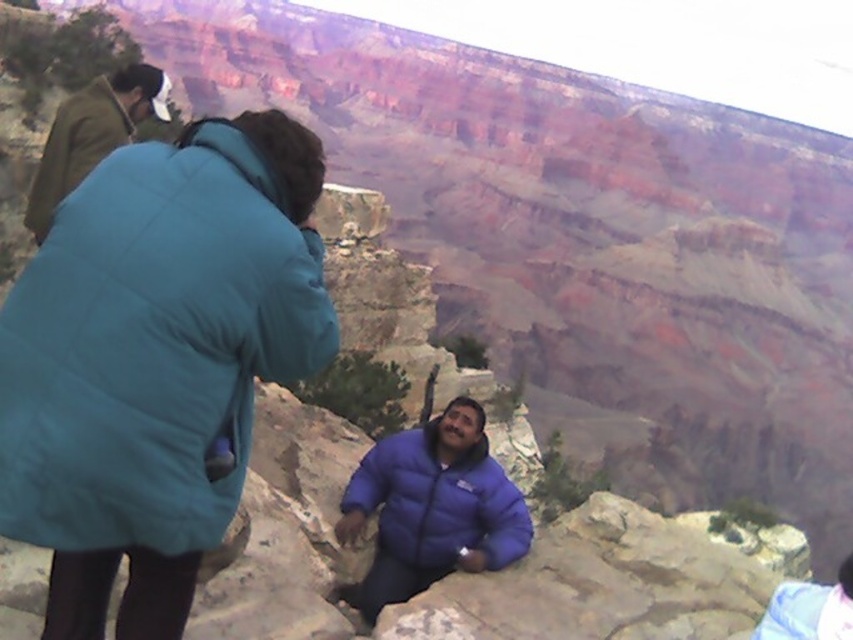
Question: Can you confirm if blue puffy jacket at center is thinner than brown woolen jacket at upper left?

Choices:
 (A) no
 (B) yes

Answer: (B)

Question: Which object is farther from the camera taking this photo?

Choices:
 (A) teal quilted jacket at upper left
 (B) brown woolen jacket at upper left
 (C) blue puffy jacket at center

Answer: (C)

Question: Is teal quilted jacket at upper left bigger than blue puffy jacket at center?

Choices:
 (A) no
 (B) yes

Answer: (B)

Question: Among these points, which one is farthest from the camera?

Choices:
 (A) pos(389,484)
 (B) pos(49,189)

Answer: (A)

Question: Can you confirm if teal quilted jacket at upper left is bigger than brown woolen jacket at upper left?

Choices:
 (A) no
 (B) yes

Answer: (B)

Question: Which is nearer to the blue puffy jacket at center?

Choices:
 (A) brown woolen jacket at upper left
 (B) teal quilted jacket at upper left

Answer: (B)